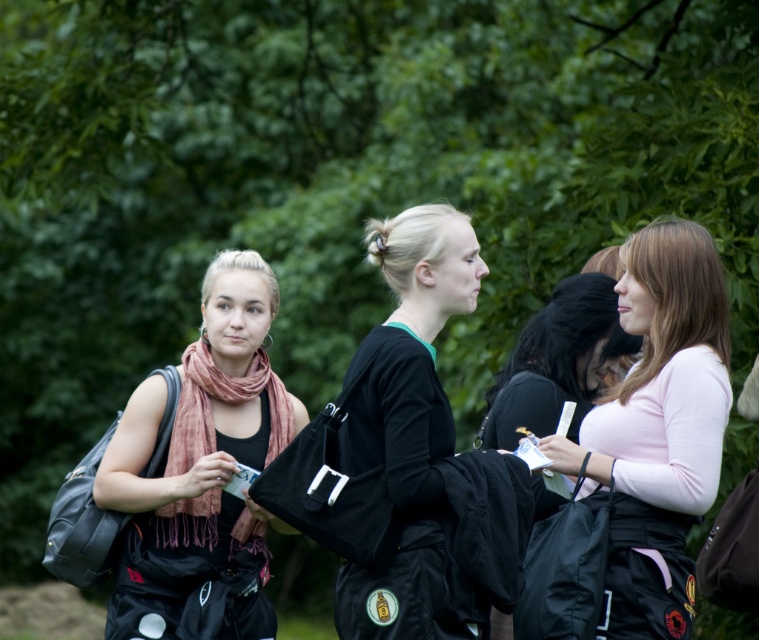
Is point (679, 426) positioned after point (367, 460)?

Yes, point (679, 426) is behind point (367, 460).

Where is `pink matte shirt at right`? The width and height of the screenshot is (759, 640). pink matte shirt at right is located at coordinates (657, 428).

Which is in front, point (663, 456) or point (354, 420)?

Positioned in front is point (354, 420).

The height and width of the screenshot is (640, 759). I want to click on pink matte shirt at right, so click(x=657, y=428).

Can you confirm if black matte jacket at center is taller than soft pink scarf at left?

Correct, black matte jacket at center is much taller as soft pink scarf at left.

Which is below, black matte jacket at center or soft pink scarf at left?

soft pink scarf at left

Is point (436, 493) positioned before point (181, 541)?

Yes, point (436, 493) is closer to viewer.

Identify the location of black matte jacket at center. This screenshot has height=640, width=759. (411, 433).

Does pink matte shirt at right appear on the left side of soft pink scarf at left?

Incorrect, pink matte shirt at right is not on the left side of soft pink scarf at left.

You are a GUI agent. You are given a task and a screenshot of the screen. Output one action in this format:
    pyautogui.click(x=<x>, y=<y>)
    Task: Click on the pink matte shirt at right
    The image size is (759, 640).
    Given the screenshot: What is the action you would take?
    pyautogui.click(x=657, y=428)

This screenshot has height=640, width=759. Identify the location of pink matte shirt at right. (657, 428).